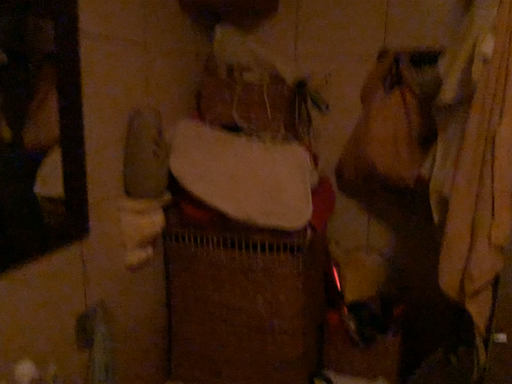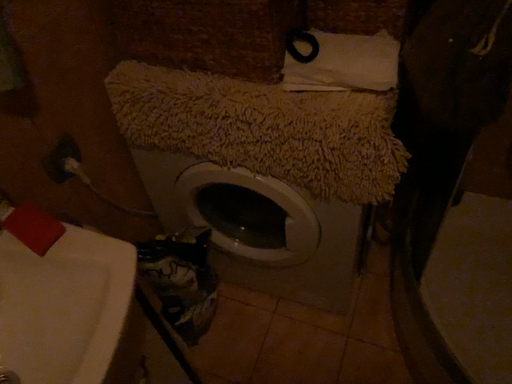
Question: Which way did the camera rotate in the video?

Choices:
 (A) rotated downward
 (B) rotated upward

Answer: (A)